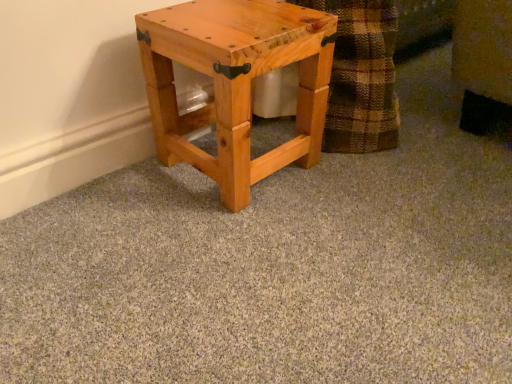
Where is `natural wood stool at lower center`? The height and width of the screenshot is (384, 512). natural wood stool at lower center is located at coordinates (234, 83).

This screenshot has height=384, width=512. Describe the element at coordinates (234, 83) in the screenshot. I see `natural wood stool at lower center` at that location.

Where is `natural wood stool at lower center`? natural wood stool at lower center is located at coordinates (234, 83).